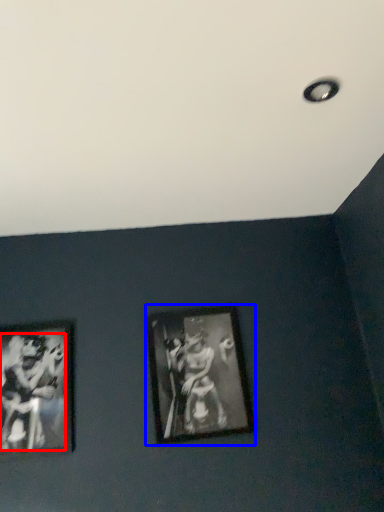
Question: Among these objects, which one is farthest to the camera, person (highlighted by a red box) or picture frame (highlighted by a blue box)?

Choices:
 (A) person
 (B) picture frame

Answer: (B)